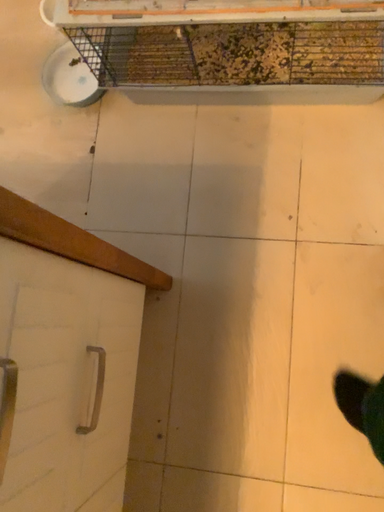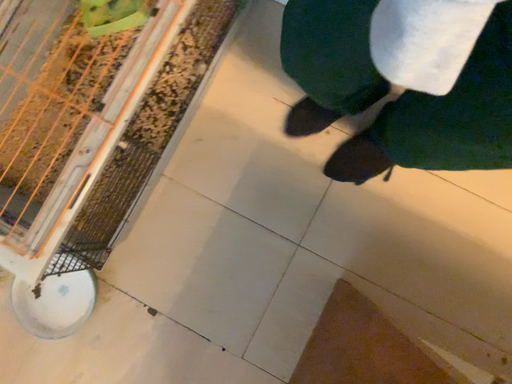
Question: How did the camera likely rotate when shooting the video?

Choices:
 (A) rotated downward
 (B) rotated upward

Answer: (B)